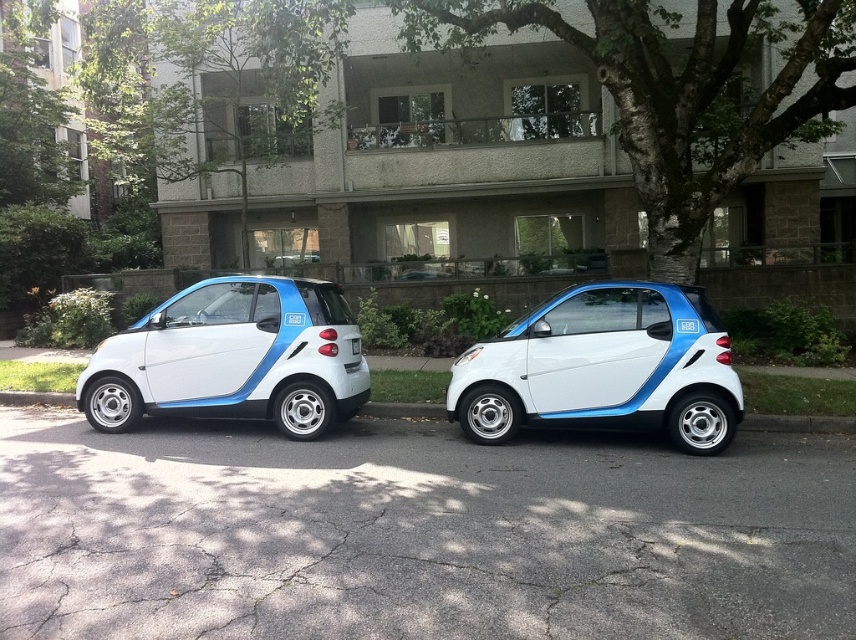
Question: Is white matte smart car at center wider than white matte smart car at left?

Choices:
 (A) yes
 (B) no

Answer: (B)

Question: Estimate the real-world distances between objects in this image. Which object is farther from the white matte smart car at center?

Choices:
 (A) white matte smart car at left
 (B) gray asphalt curb at lower center

Answer: (A)

Question: Is white matte smart car at left to the left of gray asphalt curb at lower center from the viewer's perspective?

Choices:
 (A) yes
 (B) no

Answer: (A)

Question: Considering the relative positions of white matte smart car at center and gray asphalt curb at lower center in the image provided, where is white matte smart car at center located with respect to gray asphalt curb at lower center?

Choices:
 (A) right
 (B) left

Answer: (A)

Question: Which point is closer to the camera?

Choices:
 (A) gray asphalt curb at lower center
 (B) white matte smart car at left

Answer: (B)

Question: Among these points, which one is farthest from the camera?

Choices:
 (A) (198, 346)
 (B) (496, 422)
 (C) (835, 433)

Answer: (C)